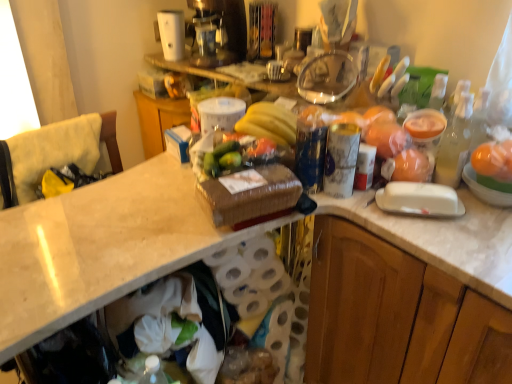
Question: Can you confirm if translucent glass bottle at right is positioned to the right of orange matte plastic oranges at upper right?

Choices:
 (A) no
 (B) yes

Answer: (B)

Question: Is translucent glass bottle at right oriented towards orange matte plastic oranges at upper right?

Choices:
 (A) yes
 (B) no

Answer: (B)

Question: From the image's perspective, is translucent glass bottle at right on orange matte plastic oranges at upper right?

Choices:
 (A) yes
 (B) no

Answer: (B)

Question: Is translucent glass bottle at right in front of orange matte plastic oranges at upper right?

Choices:
 (A) no
 (B) yes

Answer: (B)

Question: From the image's perspective, would you say translucent glass bottle at right is shown under orange matte plastic oranges at upper right?

Choices:
 (A) yes
 (B) no

Answer: (A)

Question: Looking at their shapes, would you say white plastic coffee maker at upper center is wider or thinner than yellow matte bananas at center?

Choices:
 (A) wide
 (B) thin

Answer: (B)

Question: Is point (165, 33) positioned closer to the camera than point (261, 104)?

Choices:
 (A) closer
 (B) farther

Answer: (B)

Question: From a real-world perspective, is white plastic coffee maker at upper center above or below yellow matte bananas at center?

Choices:
 (A) below
 (B) above

Answer: (B)

Question: Considering the positions of white plastic coffee maker at upper center and yellow matte bananas at center in the image, is white plastic coffee maker at upper center bigger or smaller than yellow matte bananas at center?

Choices:
 (A) small
 (B) big

Answer: (A)

Question: Looking at the image, does white plastic coffee maker at upper center seem bigger or smaller compared to translucent glass bottle at right?

Choices:
 (A) small
 (B) big

Answer: (B)

Question: Is white plastic coffee maker at upper center taller or shorter than translucent glass bottle at right?

Choices:
 (A) tall
 (B) short

Answer: (B)

Question: Is white plastic coffee maker at upper center in front of or behind translucent glass bottle at right in the image?

Choices:
 (A) behind
 (B) front

Answer: (A)

Question: From the image's perspective, is white plastic coffee maker at upper center located above or below translucent glass bottle at right?

Choices:
 (A) below
 (B) above

Answer: (B)

Question: Is yellow fabric cushion at left taller or shorter than orange matte plastic oranges at upper right?

Choices:
 (A) short
 (B) tall

Answer: (B)

Question: Is yellow fabric cushion at left in front of or behind orange matte plastic oranges at upper right in the image?

Choices:
 (A) behind
 (B) front

Answer: (B)